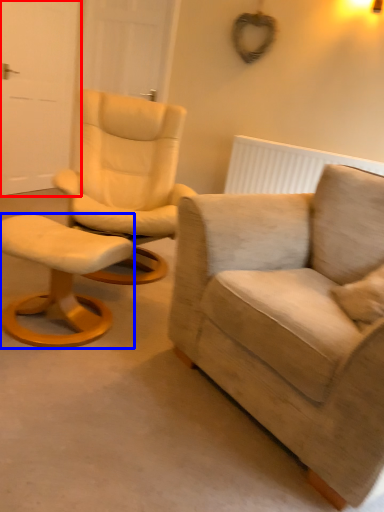
Question: Among these objects, which one is farthest to the camera, door (highlighted by a red box) or stool (highlighted by a blue box)?

Choices:
 (A) door
 (B) stool

Answer: (A)